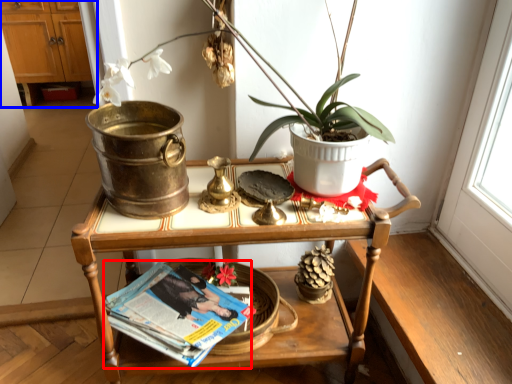
Question: Which of the following is the farthest to the observer, magazine (highlighted by a red box) or dresser (highlighted by a blue box)?

Choices:
 (A) magazine
 (B) dresser

Answer: (B)